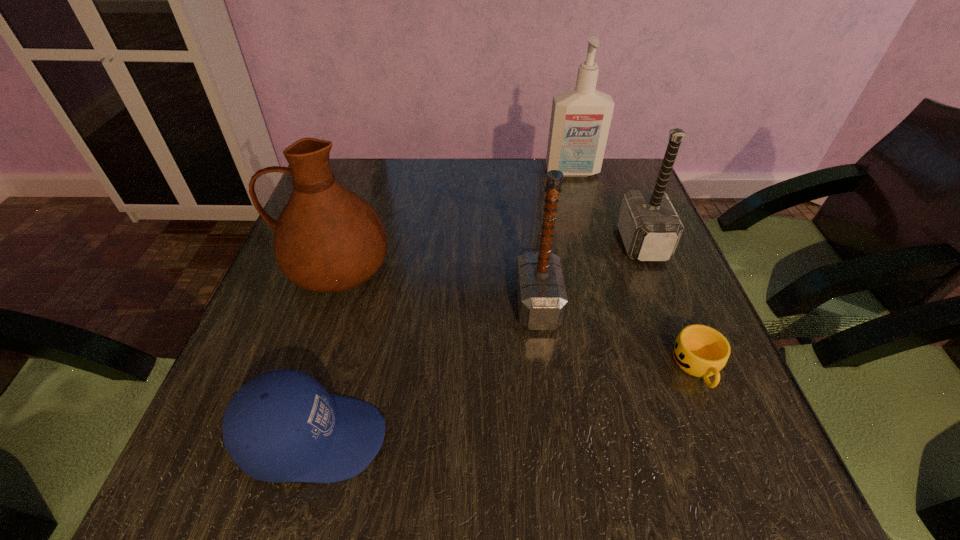
This screenshot has width=960, height=540. Find the location of `free space that satisfies the following two spatial constraints: 1. for striking with the head of the right hammer; 2. on the left side of the shortest object`. free space that satisfies the following two spatial constraints: 1. for striking with the head of the right hammer; 2. on the left side of the shortest object is located at coordinates [691, 367].